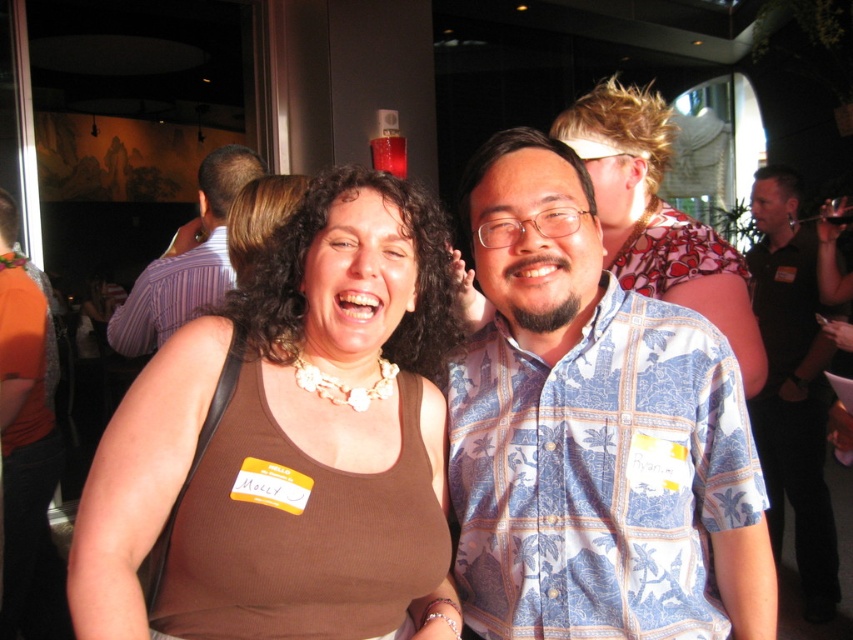
Question: Which object is closer to the camera taking this photo?

Choices:
 (A) blue printed shirt at center
 (B) purple striped shirt at center
 (C) blue patterned shirt at center

Answer: (A)

Question: Does brown ribbed tank top at center appear on the left side of purple striped shirt at center?

Choices:
 (A) yes
 (B) no

Answer: (B)

Question: Considering the real-world distances, which object is closest to the brown ribbed tank top at center?

Choices:
 (A) purple striped shirt at center
 (B) blue printed shirt at center
 (C) blue patterned shirt at center

Answer: (B)

Question: In this image, where is brown ribbed tank top at center located relative to blue patterned shirt at center?

Choices:
 (A) right
 (B) left

Answer: (B)

Question: Estimate the real-world distances between objects in this image. Which object is farther from the brown ribbed tank top at center?

Choices:
 (A) purple striped shirt at center
 (B) blue patterned shirt at center

Answer: (B)

Question: Can you confirm if brown ribbed tank top at center is wider than blue patterned shirt at center?

Choices:
 (A) yes
 (B) no

Answer: (A)